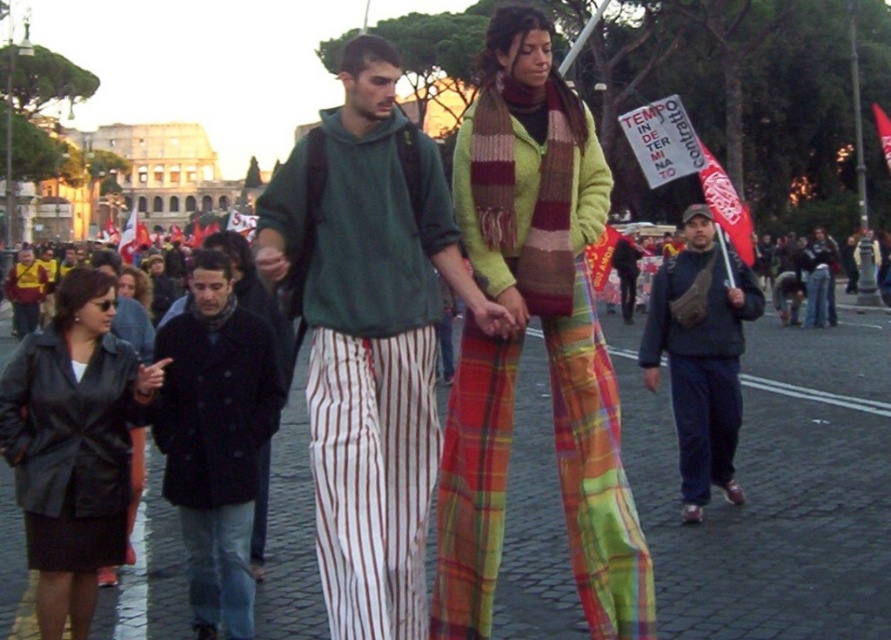
You are a photographer trying to capture the dark blue wool coat at center in the frame. Based on its position coordinates, where should you aim your camera?

The dark blue wool coat at center is located at coordinates point [215,440], so you should aim your camera towards that point to capture it.

You are a photographer trying to capture a photo of the dark blue wool coat at center and the dark blue fleece at center from a distance. Which one will appear taller in your photo?

The dark blue wool coat at center will appear taller in the photo since it is much taller than the dark blue fleece at center.

You are a photographer positioned at the front of the crowd. You want to take a photo that includes both the dark blue jeans at center and the leather jacket at center. Which object will appear closer to the camera in the photo?

The dark blue jeans at center will appear closer to the camera in the photo because it is further to the viewer than the leather jacket at center.